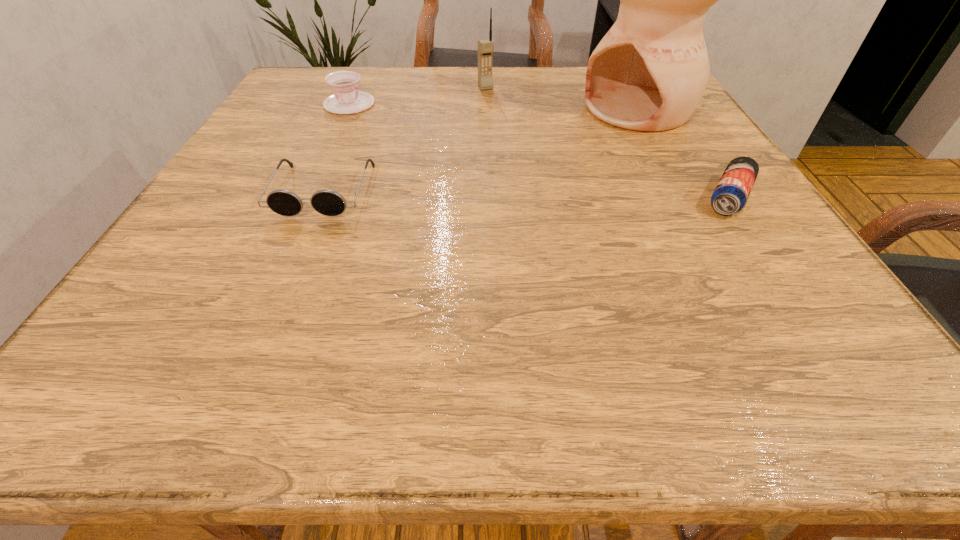
The height and width of the screenshot is (540, 960). In order to click on free space located at the open side of the pottery in this screenshot , I will do `click(570, 143)`.

You are a GUI agent. You are given a task and a screenshot of the screen. Output one action in this format:
    pyautogui.click(x=<x>, y=<y>)
    Task: Click on the vacant region located 0.210m on the handle side of the teacup
    This screenshot has height=540, width=960.
    Given the screenshot: What is the action you would take?
    pyautogui.click(x=426, y=143)

Identify the location of free space located 0.330m on the handle side of the teacup. The width and height of the screenshot is (960, 540). (468, 164).

Image resolution: width=960 pixels, height=540 pixels. Find the location of `free region located 0.360m on the handle side of the teacup`. free region located 0.360m on the handle side of the teacup is located at coordinates (479, 170).

Identify the location of free region located 0.110m on the front of the third object from left to right, where the keypad is located. This screenshot has width=960, height=540. (499, 111).

Identify the location of vacant space located 0.400m on the front of the third object from left to right, where the keypad is located. (541, 179).

The height and width of the screenshot is (540, 960). In order to click on free space located on the front of the third object from left to right, where the keypad is located in this screenshot , I will do `click(510, 127)`.

Locate an element on the screen. pottery that is at the far edge is located at coordinates (649, 72).

Locate an element on the screen. This screenshot has width=960, height=540. teacup present at the far edge is located at coordinates (346, 99).

Where is `cellular telephone that is positioned at the far edge`? The image size is (960, 540). cellular telephone that is positioned at the far edge is located at coordinates (485, 47).